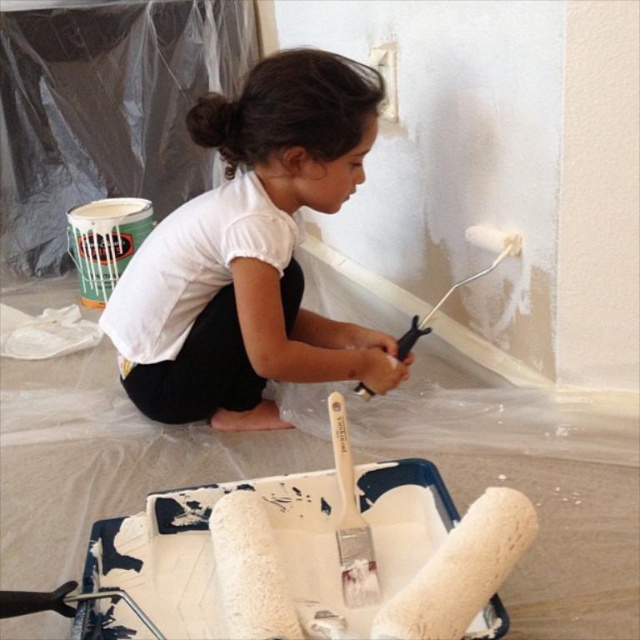
You are a painter who needs to choose between two items in the scene to protect your clothes from paint splatters. Which item would be more effective at covering a larger area of your body, the white matte shirt at center or the white matte paint roller at upper center?

The white matte shirt at center is bigger than the white matte paint roller at upper center, so it would cover a larger area of your body and be more effective at protecting from paint splatters.